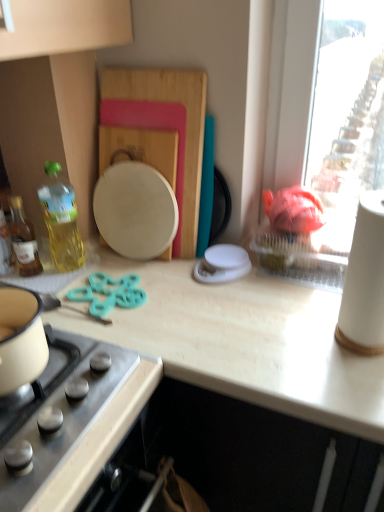
In order to click on free point above teal plastic scissors at center (from a real-world perspective) in this screenshot , I will do `click(110, 290)`.